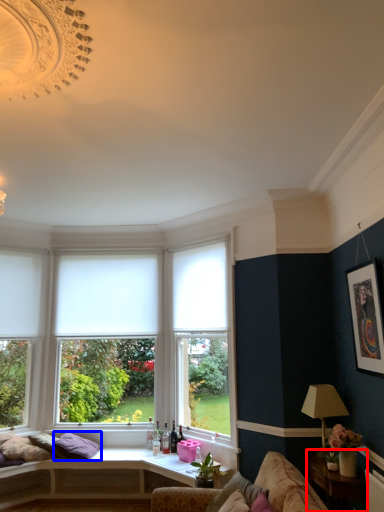
Question: Which object is closer to the camera taking this photo, table (highlighted by a red box) or pillow (highlighted by a blue box)?

Choices:
 (A) table
 (B) pillow

Answer: (A)